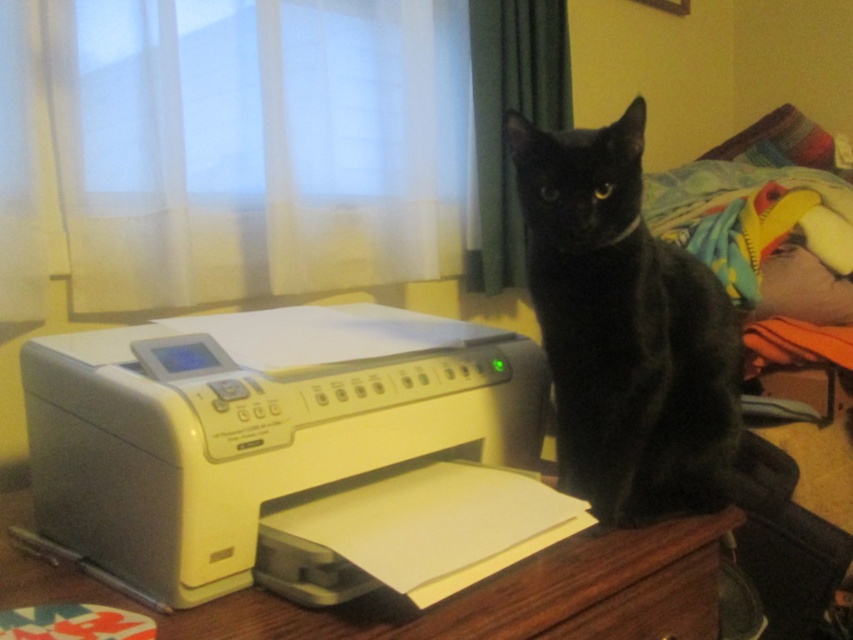
Does point (692, 604) come farther from viewer compared to point (689, 600)?

That is True.

Identify the location of wooden table at center. (447, 596).

Which is in front, point (596, 636) or point (672, 628)?

Point (596, 636)

Where is `wooden table at center`? wooden table at center is located at coordinates (447, 596).

Which of these two, white plastic printer at lower left or wooden table at center, stands taller?

white plastic printer at lower left is taller.

Can you confirm if white plastic printer at lower left is shorter than wooden table at center?

No, white plastic printer at lower left is not shorter than wooden table at center.

Is point (474, 442) more distant than point (442, 630)?

That is True.

Where is `white plastic printer at lower left`? white plastic printer at lower left is located at coordinates (292, 452).

Is black glossy cat at center positioned behind wooden table at center?

That is True.

Which is below, black glossy cat at center or wooden table at center?

wooden table at center is below.

Between point (618, 416) and point (302, 618), which one is positioned behind?

Point (618, 416)

The width and height of the screenshot is (853, 640). Find the location of `black glossy cat at center`. black glossy cat at center is located at coordinates (624, 328).